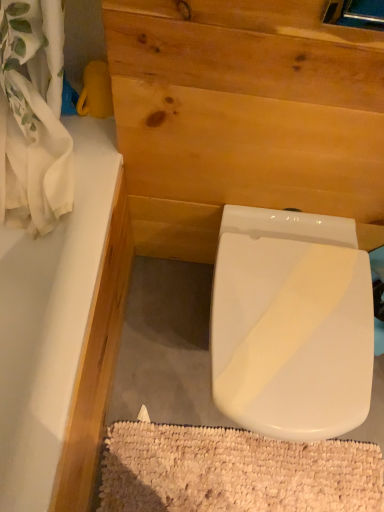
Locate an element on the screen. This screenshot has width=384, height=512. white glossy bathtub at upper left is located at coordinates (50, 320).

What do you see at coordinates (291, 324) in the screenshot?
I see `white glossy toilet at center` at bounding box center [291, 324].

This screenshot has width=384, height=512. Find the location of `white glossy bathtub at upper left`. white glossy bathtub at upper left is located at coordinates (50, 320).

Considering the relative sizes of white glossy bathtub at upper left and white textured bath mat at lower center in the image provided, is white glossy bathtub at upper left taller than white textured bath mat at lower center?

Indeed, white glossy bathtub at upper left has a greater height compared to white textured bath mat at lower center.

Can you confirm if white glossy bathtub at upper left is bigger than white textured bath mat at lower center?

Correct, white glossy bathtub at upper left is larger in size than white textured bath mat at lower center.

From a real-world perspective, between white glossy bathtub at upper left and white textured bath mat at lower center, who is vertically lower?

white textured bath mat at lower center, from a real-world perspective.

Is white glossy bathtub at upper left aimed at white textured bath mat at lower center?

Yes, white glossy bathtub at upper left is facing white textured bath mat at lower center.

How many degrees apart are the facing directions of white textured bath mat at lower center and white glossy bathtub at upper left?

89.4 degrees.

I want to click on bath mat on the right of white glossy bathtub at upper left, so click(234, 471).

Based on their sizes in the image, would you say white textured bath mat at lower center is bigger or smaller than white glossy bathtub at upper left?

In the image, white textured bath mat at lower center appears to be smaller than white glossy bathtub at upper left.

Is white textured bath mat at lower center situated inside white glossy bathtub at upper left or outside?

white textured bath mat at lower center is located beyond the bounds of white glossy bathtub at upper left.

Could white textured bath mat at lower center be considered to be inside white glossy toilet at center?

No, white glossy toilet at center does not contain white textured bath mat at lower center.

Based on the photo, does white glossy toilet at center have a lesser height compared to white textured bath mat at lower center?

No.

Considering the relative sizes of white glossy toilet at center and white textured bath mat at lower center in the image provided, is white glossy toilet at center smaller than white textured bath mat at lower center?

Actually, white glossy toilet at center might be larger than white textured bath mat at lower center.

Does white glossy toilet at center appear on the right side of white textured bath mat at lower center?

Yes.

Which of these two, white glossy bathtub at upper left or natural wood plywood at center, is smaller?

natural wood plywood at center is smaller.

Is white glossy bathtub at upper left inside the boundaries of natural wood plywood at center, or outside?

white glossy bathtub at upper left is not enclosed by natural wood plywood at center.

Is white glossy bathtub at upper left further to camera compared to natural wood plywood at center?

Yes, white glossy bathtub at upper left is further from the camera.

From the image's perspective, between white glossy bathtub at upper left and natural wood plywood at center, which one is located above?

natural wood plywood at center is shown above in the image.

From the image's perspective, is natural wood plywood at center on white textured bath mat at lower center?

Indeed, from the image's perspective, natural wood plywood at center is shown above white textured bath mat at lower center.

How different are the orientations of natural wood plywood at center and white textured bath mat at lower center in degrees?

The angular difference between natural wood plywood at center and white textured bath mat at lower center is 0.0272 degrees.

In the image, is natural wood plywood at center positioned in front of or behind white textured bath mat at lower center?

Clearly, natural wood plywood at center is in front of white textured bath mat at lower center.

This screenshot has width=384, height=512. I want to click on plywood above the white textured bath mat at lower center (from a real-world perspective), so click(249, 150).

Consider the image. Visually, is white textured bath mat at lower center positioned to the left or to the right of natural wood plywood at center?

white textured bath mat at lower center is to the left of natural wood plywood at center.

From a real-world perspective, relative to natural wood plywood at center, is white textured bath mat at lower center vertically above or below?

Clearly, from a real-world perspective, white textured bath mat at lower center is below natural wood plywood at center.

From the image's perspective, is white textured bath mat at lower center over natural wood plywood at center?

No.

Is white textured bath mat at lower center next to natural wood plywood at center?

They are not placed beside each other.

Between white glossy toilet at center and natural wood plywood at center, which one has larger size?

natural wood plywood at center is bigger.

How different are the orientations of white glossy toilet at center and natural wood plywood at center in degrees?

There is a 0.545-degree angle between the facing directions of white glossy toilet at center and natural wood plywood at center.

Which is nearer, (x=228, y=215) or (x=248, y=134)?

Point (x=228, y=215) is farther from the camera than point (x=248, y=134).

The width and height of the screenshot is (384, 512). In order to click on bathtub in front of the white textured bath mat at lower center in this screenshot , I will do `click(50, 320)`.

Locate an element on the screen. bath mat below the white glossy bathtub at upper left (from a real-world perspective) is located at coordinates (234, 471).

Estimate the real-world distances between objects in this image. Which object is closer to white textured bath mat at lower center, white glossy bathtub at upper left or white glossy toilet at center?

white glossy toilet at center is positioned closer to the anchor white textured bath mat at lower center.

Based on the photo, estimate the real-world distances between objects in this image. Which object is closer to white glossy bathtub at upper left, natural wood plywood at center or white glossy toilet at center?

natural wood plywood at center is positioned closer to the anchor white glossy bathtub at upper left.

Considering their positions, is natural wood plywood at center positioned closer to white glossy bathtub at upper left than white textured bath mat at lower center?

natural wood plywood at center is positioned closer to the anchor white glossy bathtub at upper left.

Looking at the image, which one is located further to natural wood plywood at center, white glossy toilet at center or white textured bath mat at lower center?

white textured bath mat at lower center is further to natural wood plywood at center.

When comparing their distances from natural wood plywood at center, does white glossy toilet at center or white glossy bathtub at upper left seem further?

white glossy bathtub at upper left.

When comparing their distances from white glossy bathtub at upper left, does white glossy toilet at center or natural wood plywood at center seem closer?

The object closer to white glossy bathtub at upper left is natural wood plywood at center.

Considering their positions, is white glossy bathtub at upper left positioned further to white glossy toilet at center than white textured bath mat at lower center?

Among the two, white textured bath mat at lower center is located further to white glossy toilet at center.

Based on their spatial positions, is white textured bath mat at lower center or natural wood plywood at center further from white glossy toilet at center?

white textured bath mat at lower center is further to white glossy toilet at center.

Where is `toilet situated between white glossy bathtub at upper left and natural wood plywood at center from left to right`? toilet situated between white glossy bathtub at upper left and natural wood plywood at center from left to right is located at coordinates (291, 324).

Locate an element on the screen. The width and height of the screenshot is (384, 512). bathtub between natural wood plywood at center and white textured bath mat at lower center in the up-down direction is located at coordinates (50, 320).

This screenshot has height=512, width=384. Identify the location of toilet between natural wood plywood at center and white textured bath mat at lower center from top to bottom. (291, 324).

You are a GUI agent. You are given a task and a screenshot of the screen. Output one action in this format:
    pyautogui.click(x=<x>, y=<y>)
    Task: Click on the bath mat situated between white glossy bathtub at upper left and white glossy toilet at center from left to right
    
    Given the screenshot: What is the action you would take?
    click(x=234, y=471)